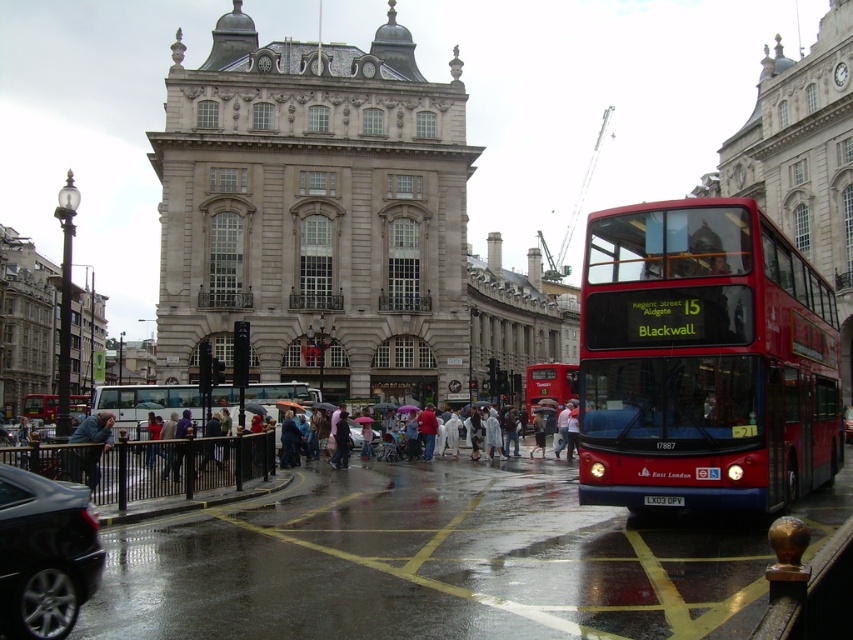
In the scene shown: Does red rubber bus at center appear under blue denim jacket at lower left?

Incorrect, red rubber bus at center is not positioned below blue denim jacket at lower left.

Is point (555, 368) farther from viewer compared to point (86, 419)?

Yes, it is.

Where is `red rubber bus at center`? The image size is (853, 640). red rubber bus at center is located at coordinates (549, 385).

From the picture: Who is lower down, red metallic bus at center or red rubber bus at center?

Positioned lower is red rubber bus at center.

Is point (718, 244) closer to camera compared to point (544, 371)?

Yes, point (718, 244) is in front of point (544, 371).

Is point (763, 244) positioned behind point (532, 401)?

No, (763, 244) is closer to viewer.

Locate an element on the screen. red metallic bus at center is located at coordinates (703, 360).

Can you confirm if shiny black car at lower left is positioned below matte white bus at center?

Indeed, shiny black car at lower left is positioned under matte white bus at center.

Is point (70, 528) positioned in front of point (245, 394)?

Yes.

You are a GUI agent. You are given a task and a screenshot of the screen. Output one action in this format:
    pyautogui.click(x=<x>, y=<y>)
    Task: Click on the shiny black car at lower left
    This screenshot has height=640, width=853.
    Given the screenshot: What is the action you would take?
    pyautogui.click(x=44, y=554)